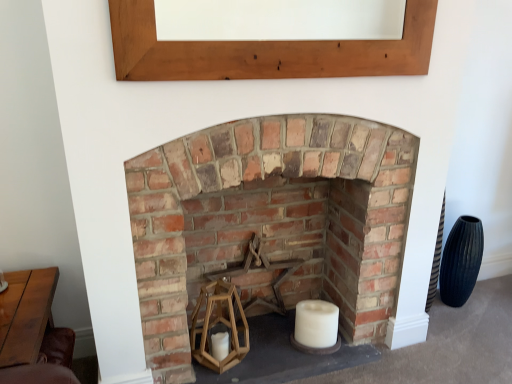
You are a GUI agent. You are given a task and a screenshot of the screen. Output one action in this format:
    pyautogui.click(x=<x>, y=<y>)
    Task: Click on the vacant space situated above white matte candle at center (from a real-world perspective)
    The height and width of the screenshot is (384, 512).
    Given the screenshot: What is the action you would take?
    pyautogui.click(x=321, y=308)